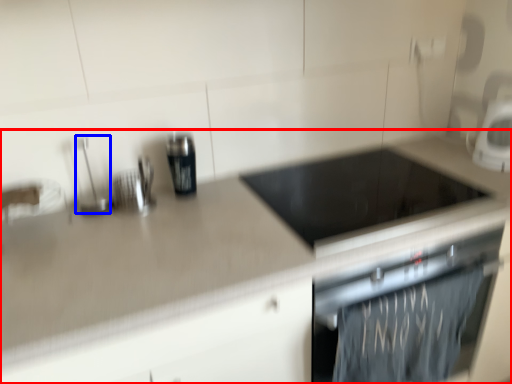
Question: Among these objects, which one is nearest to the camera, countertop (highlighted by a red box) or appliance (highlighted by a blue box)?

Choices:
 (A) countertop
 (B) appliance

Answer: (A)